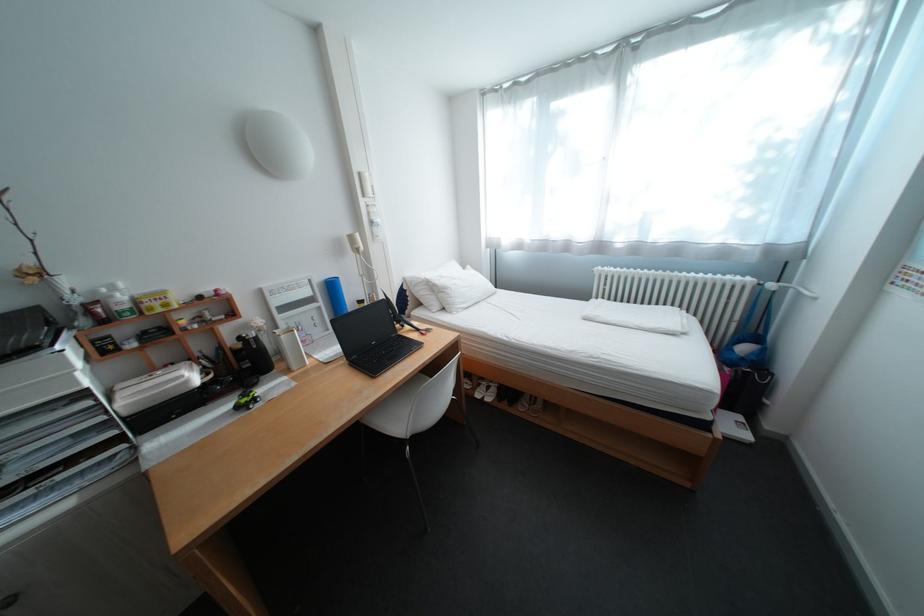
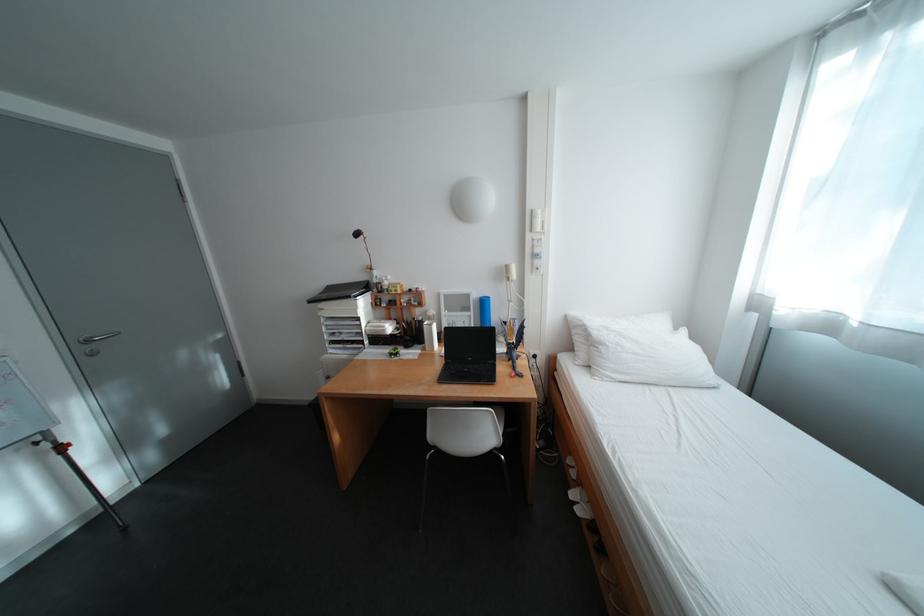
The point at (x=459, y=290) is marked in the first image. Where is the corresponding point in the second image?

(614, 346)